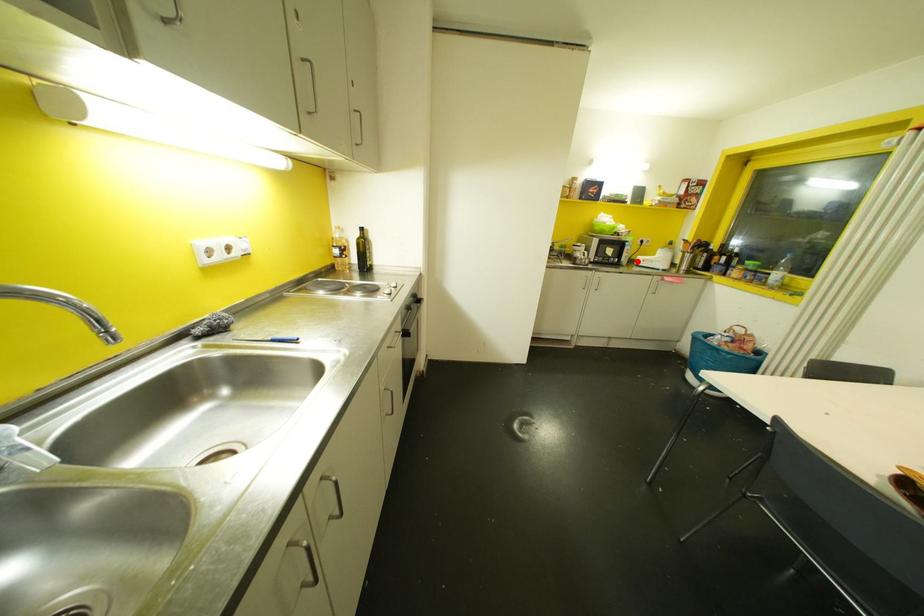
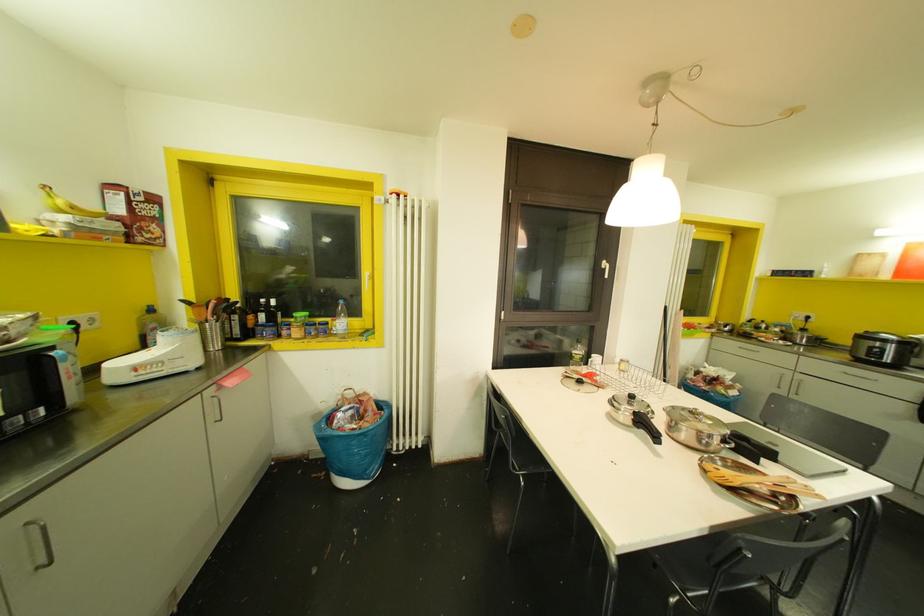
Find the pixel in the second image that matches the highlighted location in the first image.

(116, 378)